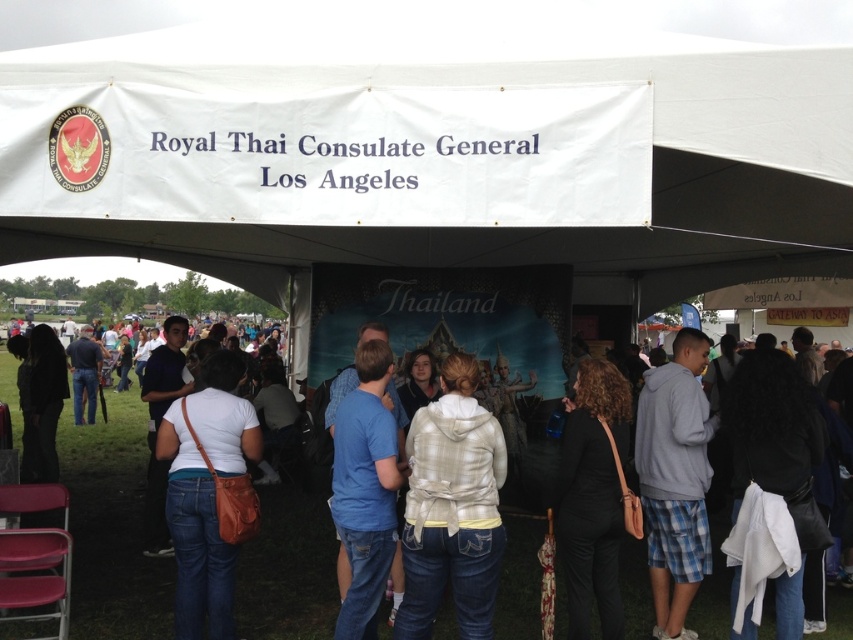
Can you confirm if denim jeans at center is bigger than white plaid hoodie at center?

Yes, denim jeans at center is bigger than white plaid hoodie at center.

Is denim jeans at center in front of white plaid hoodie at center?

No, it is not.

Is point (134, 614) closer to camera compared to point (460, 412)?

No, it is behind (460, 412).

In order to click on denim jeans at center in this screenshot , I will do `click(112, 529)`.

Is white fabric canopy at upper center taller than gray fleece hoodie at center?

Correct, white fabric canopy at upper center is much taller as gray fleece hoodie at center.

Between white fabric canopy at upper center and gray fleece hoodie at center, which one is positioned lower?

gray fleece hoodie at center

Is point (433, 0) more distant than point (653, 392)?

Yes, it is.

Locate an element on the screen. white fabric canopy at upper center is located at coordinates (425, 17).

Can you confirm if black matte pants at lower center is taller than blue cotton shirt at center?

No, black matte pants at lower center is not taller than blue cotton shirt at center.

Which is more to the left, black matte pants at lower center or blue cotton shirt at center?

From the viewer's perspective, blue cotton shirt at center appears more on the left side.

Locate an element on the screen. black matte pants at lower center is located at coordinates (592, 497).